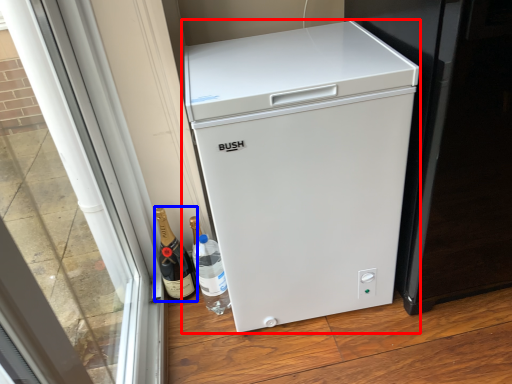
Question: Which object appears closest to the camera in this image, refrigerator (highlighted by a red box) or wine (highlighted by a blue box)?

Choices:
 (A) refrigerator
 (B) wine

Answer: (A)